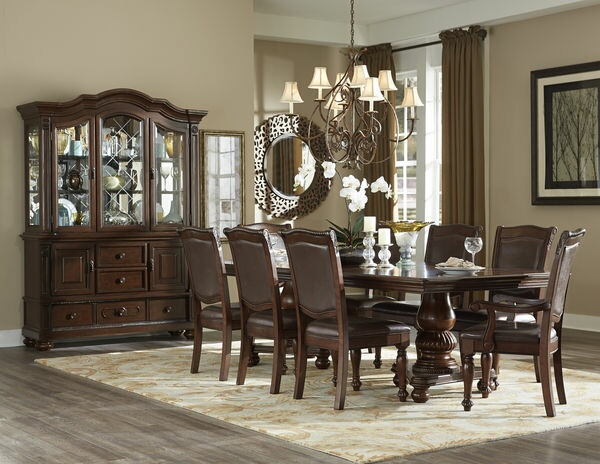
Locate an element on the screen. This screenshot has width=600, height=464. glass pane in curio cabinet is located at coordinates (31, 155), (68, 166), (125, 169), (169, 173).